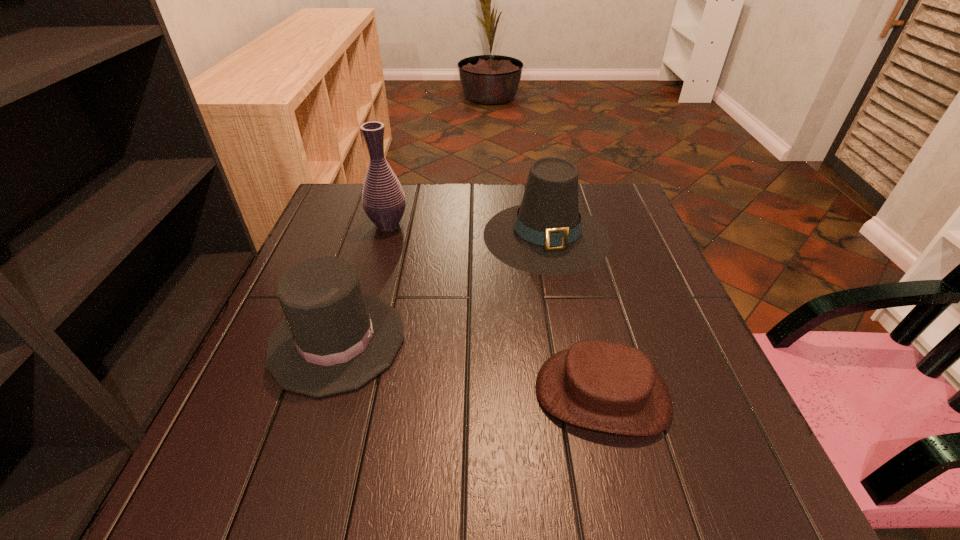
The height and width of the screenshot is (540, 960). What are the coordinates of `free region at the near right corner of the desktop` in the screenshot? It's located at (776, 511).

Identify the location of free space between the shortest object and the third tallest object. (469, 367).

The width and height of the screenshot is (960, 540). Find the location of `vacant area that lies between the second tallest hat and the farthest hat`. vacant area that lies between the second tallest hat and the farthest hat is located at coordinates (442, 288).

Identify the location of free spot between the vase and the leftmost hat. (363, 282).

Find the location of `empty space that is in between the shortest object and the leftmost hat`. empty space that is in between the shortest object and the leftmost hat is located at coordinates click(469, 367).

You are a GUI agent. You are given a task and a screenshot of the screen. Output one action in this format:
    pyautogui.click(x=<x>, y=<y>)
    Task: Click on the free space that is in between the farthest hat and the tallest object
    The height and width of the screenshot is (540, 960).
    Given the screenshot: What is the action you would take?
    pyautogui.click(x=468, y=230)

Identify the location of vacant region between the tallest object and the second shortest object. (363, 282).

Where is `free space between the shortest hat and the second shortest object`? free space between the shortest hat and the second shortest object is located at coordinates (469, 367).

Where is `vacant area that lies between the second tallest hat and the tallest object`? The width and height of the screenshot is (960, 540). vacant area that lies between the second tallest hat and the tallest object is located at coordinates coord(363,282).

Where is `vacant space that is in between the vase and the farthest hat`? The image size is (960, 540). vacant space that is in between the vase and the farthest hat is located at coordinates (468, 230).